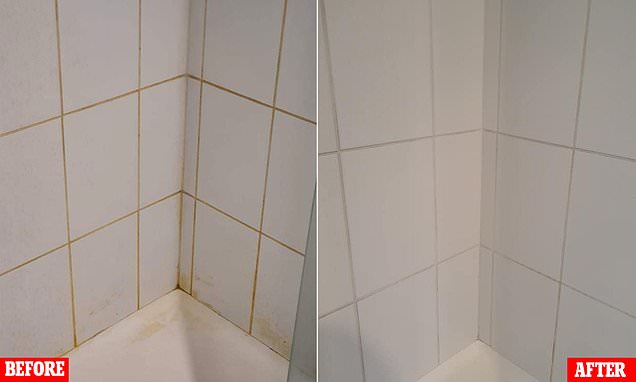
Identify the location of clean grout. (354, 300).